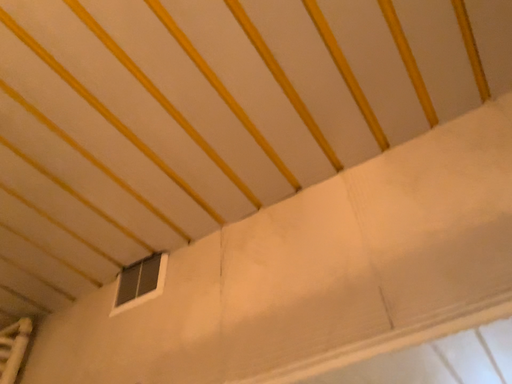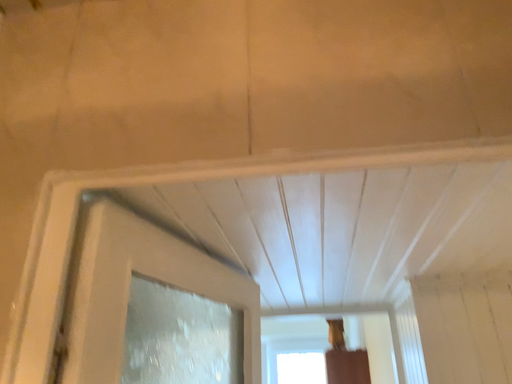
Question: How did the camera likely rotate when shooting the video?

Choices:
 (A) rotated left
 (B) rotated right

Answer: (B)